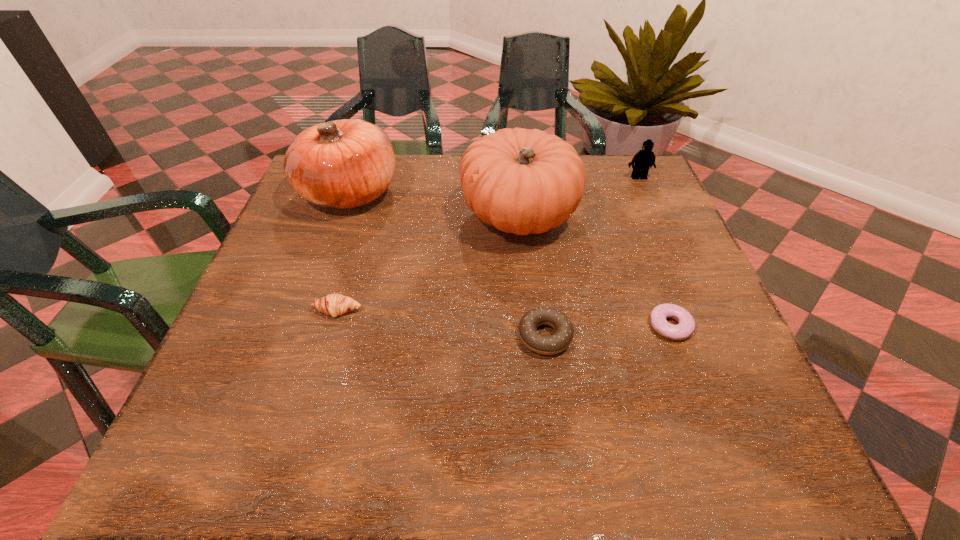
At what (x,y) coordinates should I click in order to perform the action: click on the right pumpkin. Please return your answer as a coordinate pair (x, y). Looking at the image, I should click on (521, 181).

Where is `the left pumpkin`? The width and height of the screenshot is (960, 540). the left pumpkin is located at coordinates (342, 164).

The height and width of the screenshot is (540, 960). Identify the location of the third tallest object. (644, 159).

Where is `pastry`? Image resolution: width=960 pixels, height=540 pixels. pastry is located at coordinates (334, 305).

Locate an element on the screen. the left doughnut is located at coordinates (542, 344).

Find the location of a particular element. the right doughnut is located at coordinates (686, 325).

At what (x,y) coordinates should I click in order to perform the action: click on the shortest object. Please return your answer as a coordinate pair (x, y). The width and height of the screenshot is (960, 540). Looking at the image, I should click on (686, 325).

Identify the location of vacant space located 0.340m on the left of the right pumpkin. The image size is (960, 540). (321, 215).

Image resolution: width=960 pixels, height=540 pixels. What are the coordinates of `free space located 0.050m on the back of the left pumpkin` in the screenshot? It's located at (362, 156).

You are a GUI agent. You are given a task and a screenshot of the screen. Output one action in this format:
    pyautogui.click(x=<x>, y=<y>)
    Task: Click on the vacant space located 0.220m on the face of the Lego
    This screenshot has height=540, width=960.
    Given the screenshot: What is the action you would take?
    pyautogui.click(x=663, y=234)